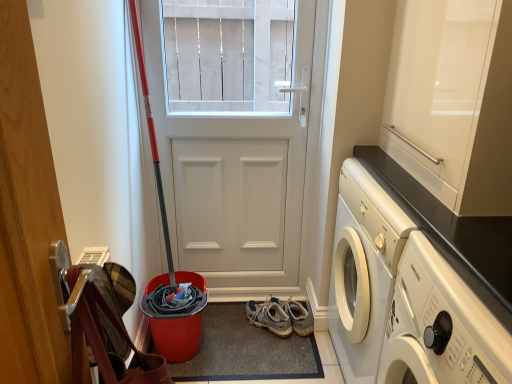
The height and width of the screenshot is (384, 512). I want to click on free space in front of gray suede sneakers at lower center, so 269,350.